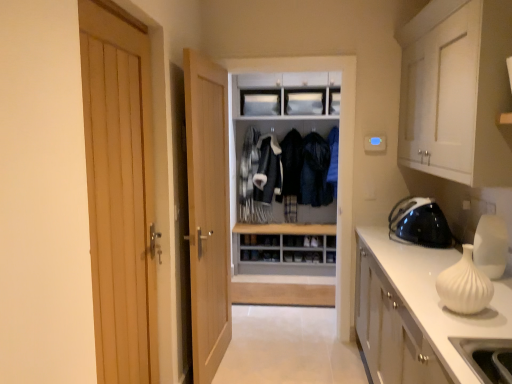
The height and width of the screenshot is (384, 512). I want to click on blank area to the left of white matte vase at right, so click(x=425, y=314).